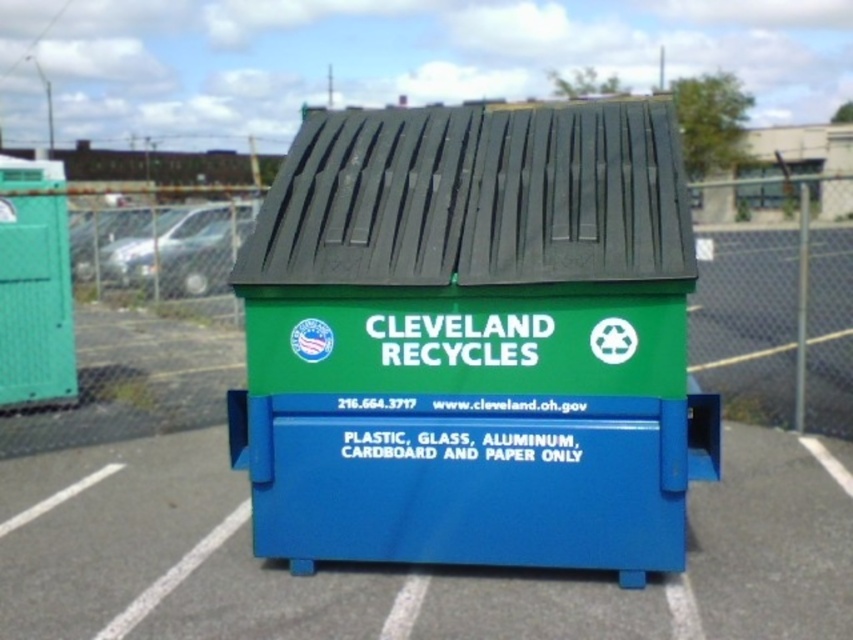
Question: Does green plastic/recycled material recycling bin at center have a lesser width compared to metal chain-link fence at center?

Choices:
 (A) yes
 (B) no

Answer: (A)

Question: Does green plastic/recycled material recycling bin at center lie in front of metal chain-link fence at center?

Choices:
 (A) no
 (B) yes

Answer: (A)

Question: Is green plastic/recycled material recycling bin at center to the right of metal chain-link fence at center from the viewer's perspective?

Choices:
 (A) no
 (B) yes

Answer: (B)

Question: Which object appears closest to the camera in this image?

Choices:
 (A) metal chain-link fence at center
 (B) green plastic/recycled material recycling bin at center

Answer: (A)

Question: Among these objects, which one is nearest to the camera?

Choices:
 (A) green plastic/recycled material recycling bin at center
 (B) metal chain-link fence at center

Answer: (B)